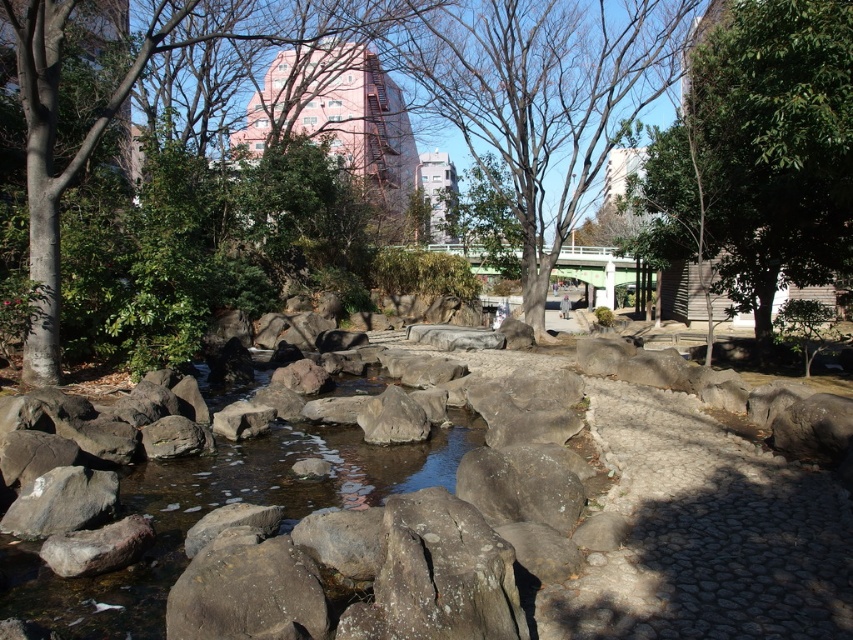
You are planning to place a small bench between the bare wood tree at center and the green leafy tree at upper left. Based on their sizes, which tree would allow more space for the bench to be placed closer to it?

The bare wood tree at center occupies less space than the green leafy tree at upper left, so the bench can be placed closer to the bare wood tree at center.

You are standing at the entrance of the park and want to walk towards the green leafy tree at center. Which direction should you head relative to the green leafy tree at upper left?

You should head to the right of the green leafy tree at upper left to reach the green leafy tree at center because the green leafy tree at center is positioned to the right of the green leafy tree at upper left.

You are standing at point (x=759, y=154) in the park. What can you see directly in front of you?

You can see a green leafy tree at center directly in front of you at point (x=759, y=154).